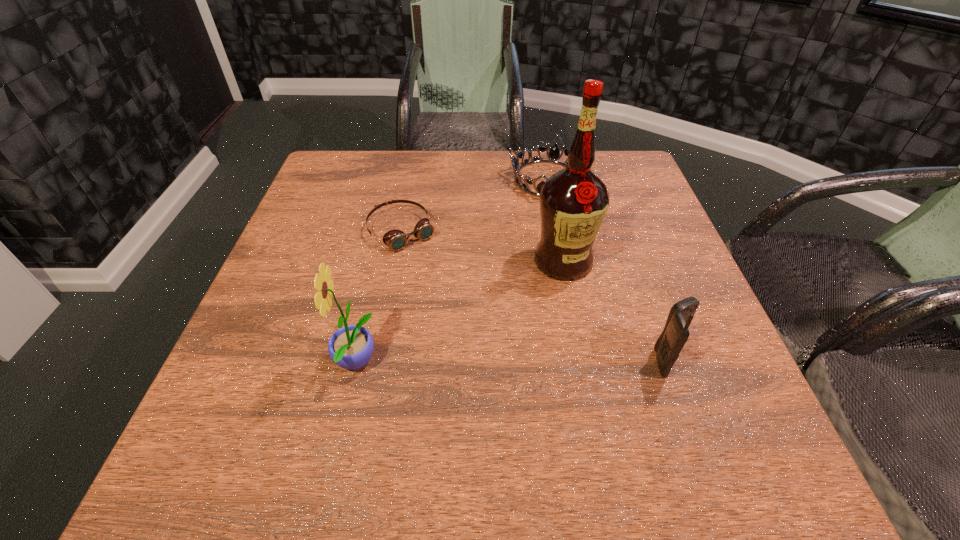
Locate an element on the screen. The image size is (960, 540). free space between the fourth tallest object and the sunflower is located at coordinates (451, 271).

Locate an element on the screen. Image resolution: width=960 pixels, height=540 pixels. free space between the goggles and the second tallest object is located at coordinates (378, 297).

At what (x,y) coordinates should I click in order to perform the action: click on free spot between the cellular telephone and the shortest object. Please return your answer as a coordinate pair (x, y). Image resolution: width=960 pixels, height=540 pixels. Looking at the image, I should click on (534, 296).

The image size is (960, 540). What are the coordinates of `free spot between the cellular telephone and the tiara` in the screenshot? It's located at (607, 270).

This screenshot has height=540, width=960. Find the location of `object that is the closest to the third tallest object`. object that is the closest to the third tallest object is located at coordinates (573, 202).

Point out which object is positioned as the fourth nearest to the rightmost object. Please provide its 2D coordinates. Your answer should be formatted as a tuple, i.e. [(x, y)], where the tuple contains the x and y coordinates of a point satisfying the conditions above.

[(350, 347)]

What are the coordinates of `free space that satisfies the following two spatial constraints: 1. on the front side of the rightmost object; 2. on the keyboard of the alcohol` in the screenshot? It's located at (583, 361).

Where is `vacant space that satisfies the following two spatial constraints: 1. on the front side of the fourth tallest object; 2. on the keyboard of the rightmost object`? The image size is (960, 540). vacant space that satisfies the following two spatial constraints: 1. on the front side of the fourth tallest object; 2. on the keyboard of the rightmost object is located at coordinates (584, 361).

You are a GUI agent. You are given a task and a screenshot of the screen. Output one action in this format:
    pyautogui.click(x=<x>, y=<y>)
    Task: Click on the free space that satisfies the following two spatial constraints: 1. on the front side of the cellular telephone; 2. on the keyboard of the shortest object
    The height and width of the screenshot is (540, 960).
    Given the screenshot: What is the action you would take?
    pyautogui.click(x=376, y=361)